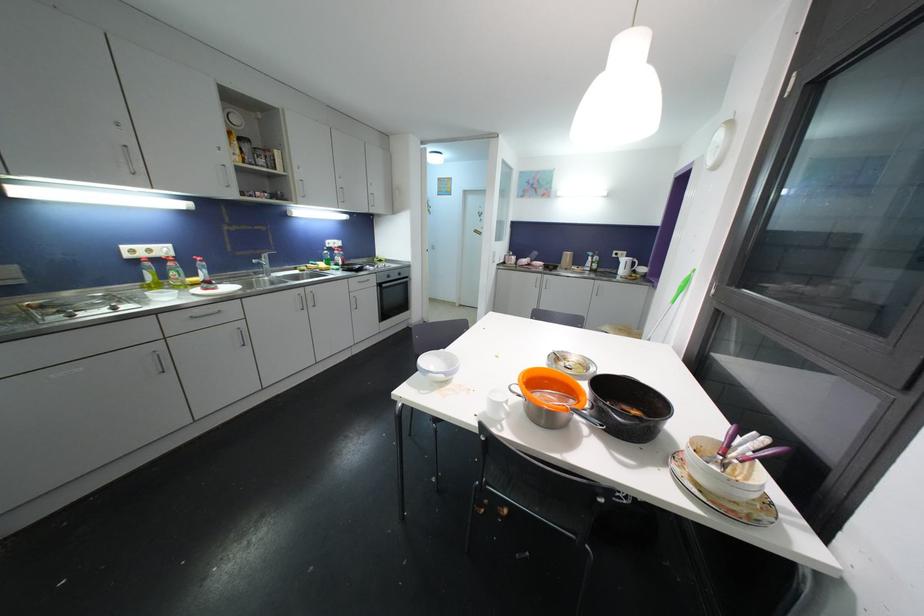
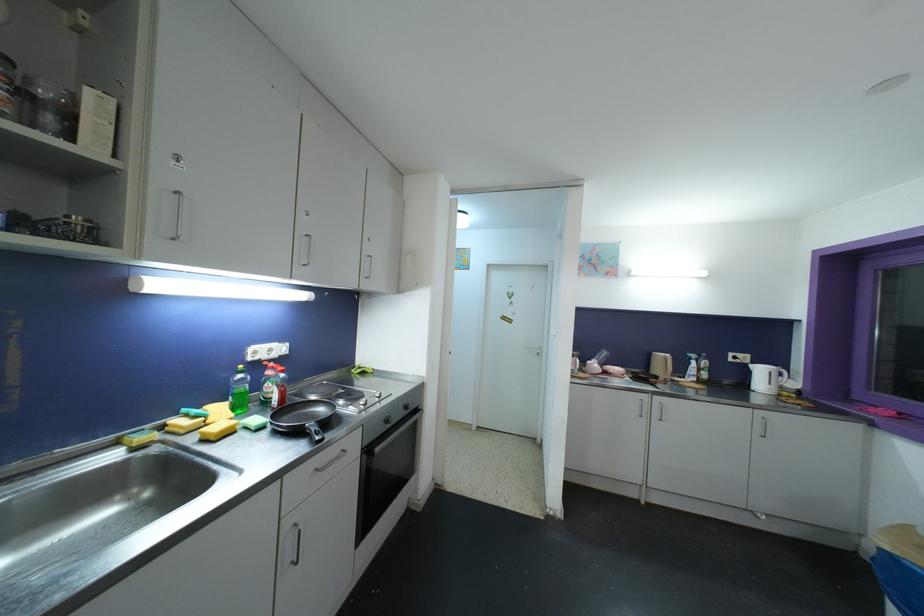
Find the pixel in the second image that matches pixel 627 264 in the first image.

(763, 373)